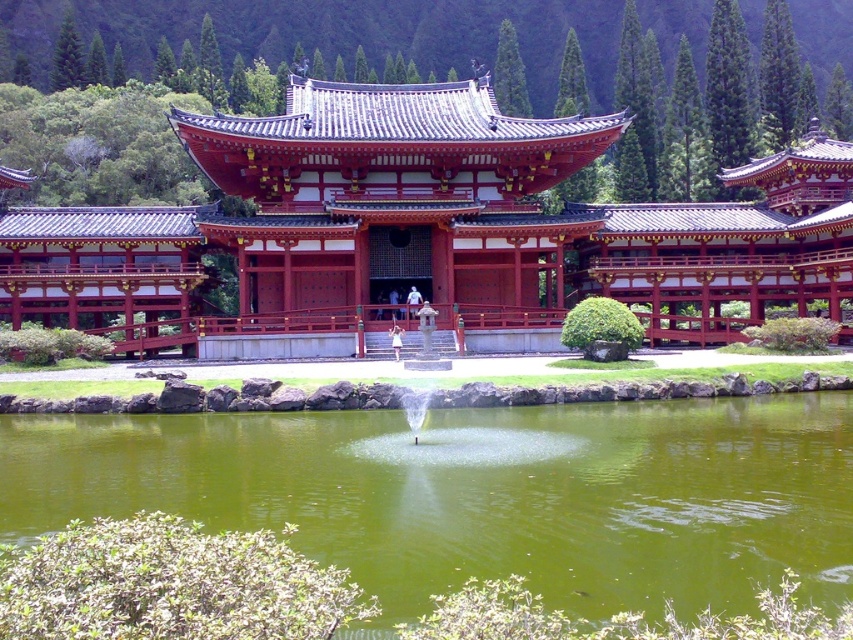
You are standing in front of the traditional East Asian structure and notice the matte red pagoda at center and the green liquid water at center. From your perspective, which object is positioned to the left?

The matte red pagoda at center is positioned to the left of the green liquid water at center.

You are standing at the entrance of the temple complex and want to locate the matte red pagoda at center. According to the coordinates provided, where should you look to find it?

The matte red pagoda at center is located at point coordinates (426, 227), so you should look towards that coordinate position to find it.

You are an architect visiting this East Asian temple complex. You notice the matte red pagoda at center and the green liquid water at center. Which object would cast a larger shadow during midday when the sun is directly overhead?

The matte red pagoda at center has a larger size compared to green liquid water at center, so it would cast a larger shadow during midday when the sun is directly overhead.